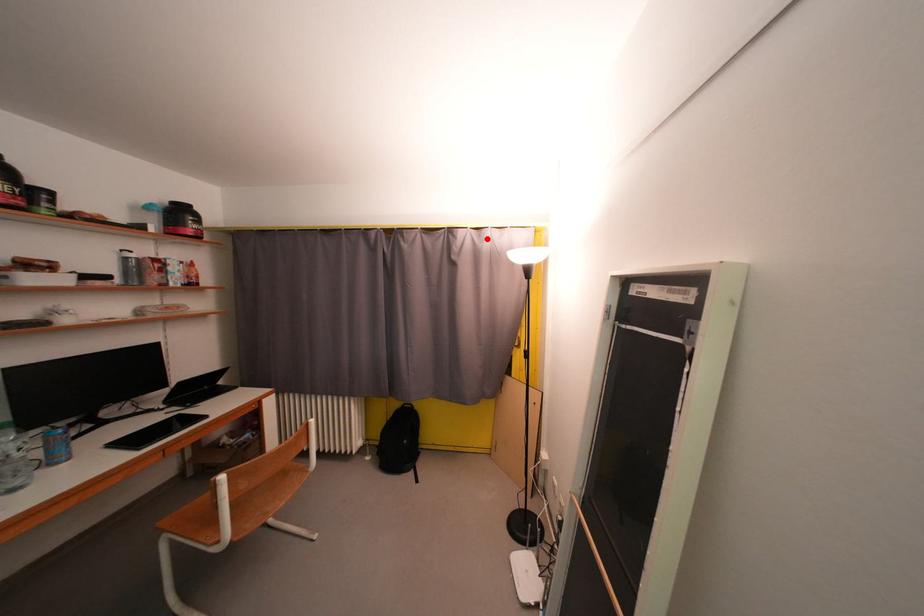
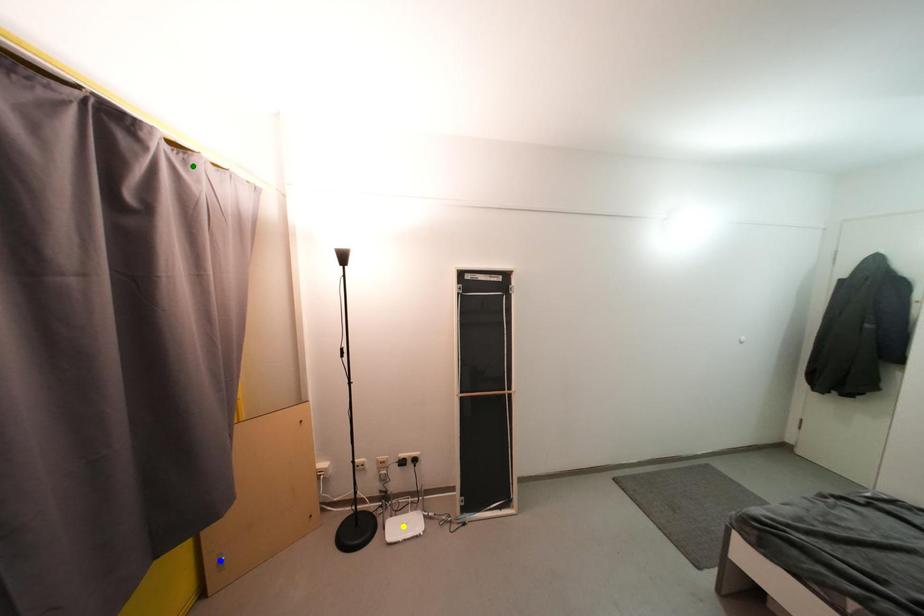
Question: I am providing you with two images of the same scene from different viewpoints. A red point is marked on the first image. You are given multiple points on the second image. Which spot in image 2 lines up with the point in image 1?

Choices:
 (A) yellow point
 (B) blue point
 (C) green point

Answer: (C)